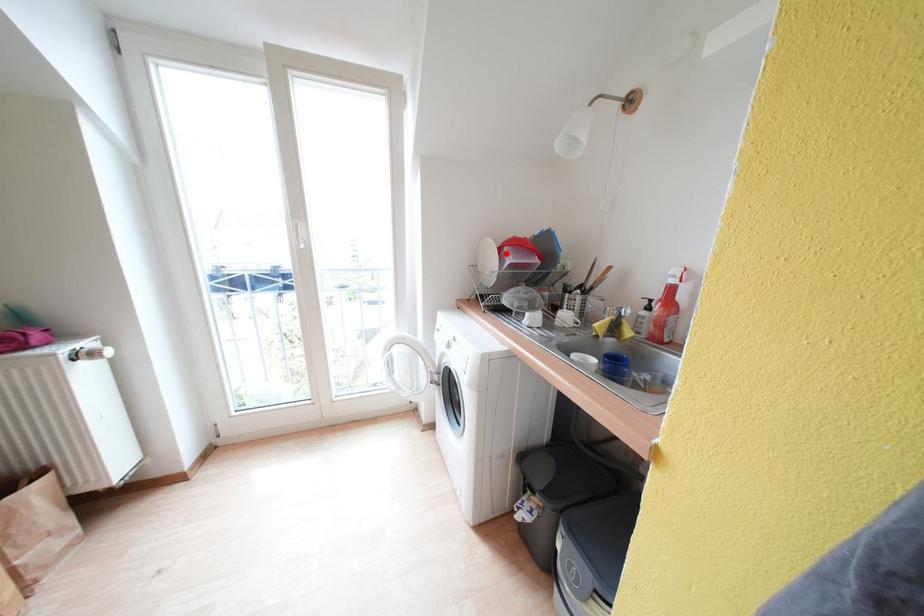
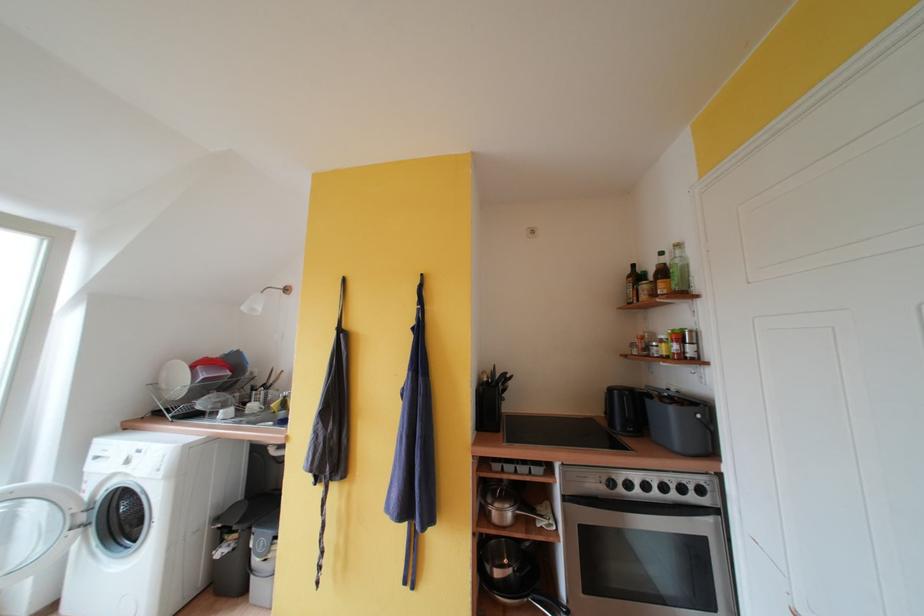
Find the pixel in the second image that matches the highlighted location in the first image.

(199, 371)